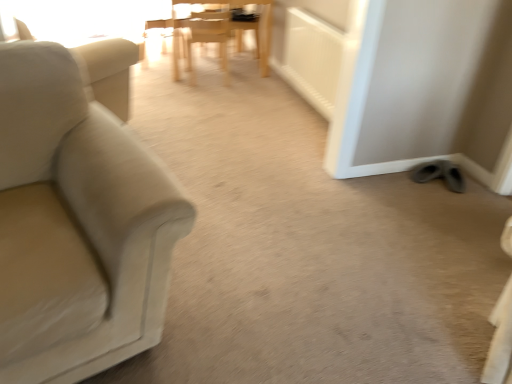
Question: Considering the relative sizes of beige fabric couch at left, arranged as the third chair when viewed from the back, and beige fabric swivel chair at left in the image provided, is beige fabric couch at left, arranged as the third chair when viewed from the back, shorter than beige fabric swivel chair at left?

Choices:
 (A) no
 (B) yes

Answer: (B)

Question: Can you confirm if beige fabric couch at left, which is the 1th chair in front-to-back order, is smaller than beige fabric swivel chair at left?

Choices:
 (A) yes
 (B) no

Answer: (A)

Question: Considering the relative sizes of beige fabric couch at left, which is counted as the 3th chair, starting from the top, and beige fabric swivel chair at left in the image provided, is beige fabric couch at left, which is counted as the 3th chair, starting from the top, taller than beige fabric swivel chair at left?

Choices:
 (A) yes
 (B) no

Answer: (B)

Question: Is beige fabric couch at left, marked as the first chair in a bottom-to-top arrangement, oriented towards beige fabric swivel chair at left?

Choices:
 (A) yes
 (B) no

Answer: (B)

Question: Is beige fabric couch at left, which is the 1th chair in front-to-back order, far from beige fabric swivel chair at left?

Choices:
 (A) yes
 (B) no

Answer: (A)

Question: Can you confirm if beige fabric couch at left, which is the 1th chair in front-to-back order, is bigger than beige fabric swivel chair at left?

Choices:
 (A) no
 (B) yes

Answer: (A)

Question: Is beige fabric swivel chair at left located outside beige fabric couch at left, which is counted as the 3th chair, starting from the top?

Choices:
 (A) no
 (B) yes

Answer: (B)

Question: Are beige fabric swivel chair at left and beige fabric couch at left, which is the 1th chair in front-to-back order, making contact?

Choices:
 (A) no
 (B) yes

Answer: (A)

Question: Does beige fabric swivel chair at left lie behind beige fabric couch at left, which is the 1th chair in front-to-back order?

Choices:
 (A) yes
 (B) no

Answer: (A)

Question: Does beige fabric swivel chair at left have a greater height compared to beige fabric couch at left, which is counted as the 3th chair, starting from the top?

Choices:
 (A) no
 (B) yes

Answer: (B)

Question: Are beige fabric swivel chair at left and beige fabric couch at left, arranged as the third chair when viewed from the back, located far from each other?

Choices:
 (A) no
 (B) yes

Answer: (B)

Question: From the image's perspective, is beige fabric swivel chair at left located above beige fabric couch at left, marked as the first chair in a bottom-to-top arrangement?

Choices:
 (A) yes
 (B) no

Answer: (A)

Question: Does wooden chair at center, which ranks as the 3th chair in front-to-back order, touch beige fabric couch at left, arranged as the third chair when viewed from the back?

Choices:
 (A) yes
 (B) no

Answer: (B)